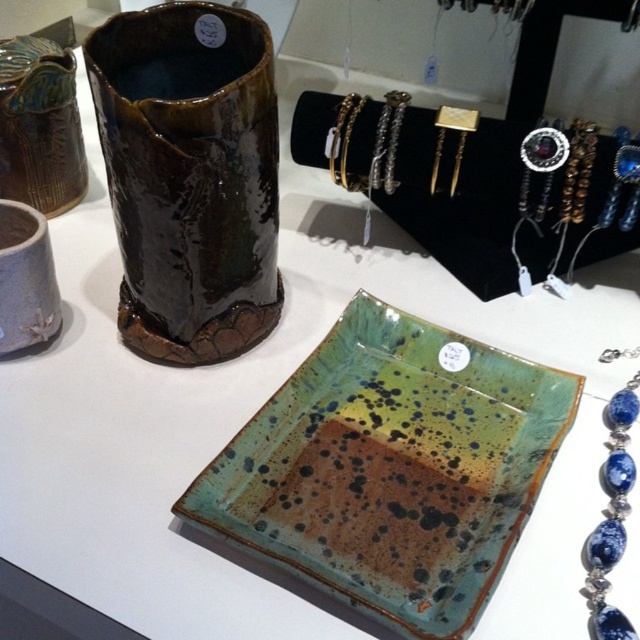
Question: Is matte brown vase at left to the right of gold metallic bracelet at upper center from the viewer's perspective?

Choices:
 (A) no
 (B) yes

Answer: (A)

Question: Does glossy ceramic vase at upper center appear over gold metallic bracelet at upper center?

Choices:
 (A) yes
 (B) no

Answer: (B)

Question: Can you confirm if glossy ceramic vase at upper center is positioned to the left of blue gemstone necklace at right?

Choices:
 (A) no
 (B) yes

Answer: (B)

Question: Based on their relative distances, which object is nearer to the glossy ceramic vase at upper center?

Choices:
 (A) matte brown vase at left
 (B) matte clay cup at left

Answer: (B)

Question: Which point is closer to the camera?

Choices:
 (A) [x=33, y=163]
 (B) [x=124, y=225]

Answer: (B)

Question: Which object is closer to the camera taking this photo?

Choices:
 (A) blue gemstone necklace at right
 (B) glossy ceramic vase at upper center
 (C) matte brown vase at left

Answer: (A)